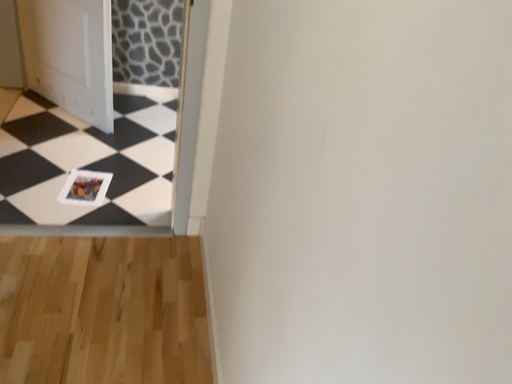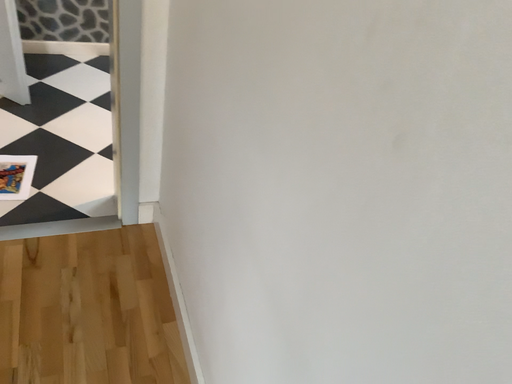
Question: Which way did the camera rotate in the video?

Choices:
 (A) rotated downward
 (B) rotated upward

Answer: (A)